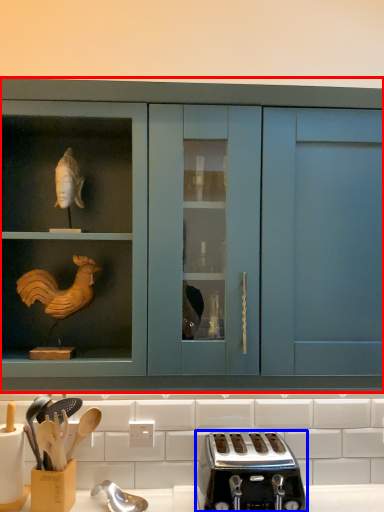
Question: Which object is further to the camera taking this photo, cabinetry (highlighted by a red box) or toaster (highlighted by a blue box)?

Choices:
 (A) cabinetry
 (B) toaster

Answer: (B)